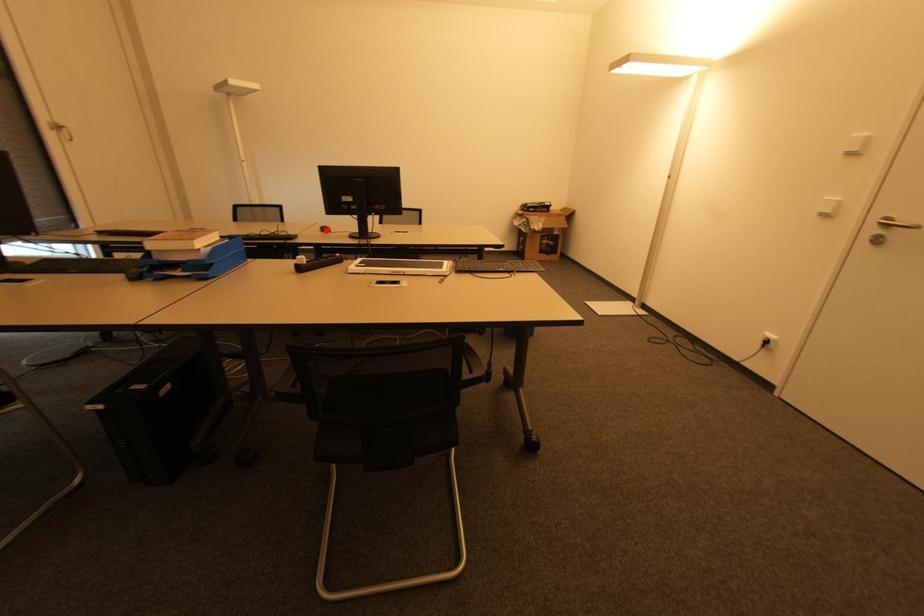
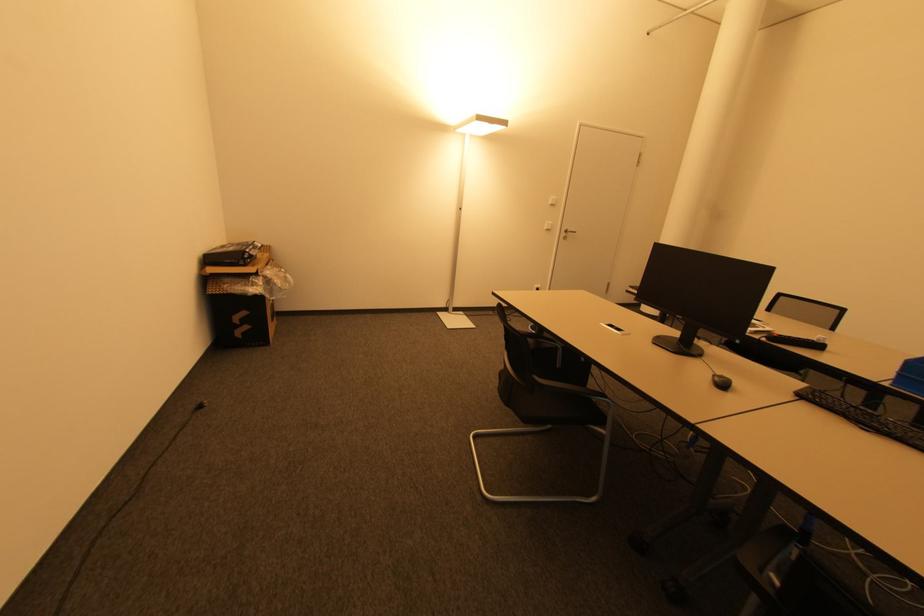
Where in the second image is the point corresponding to the highlighted location from the first image?

(725, 386)